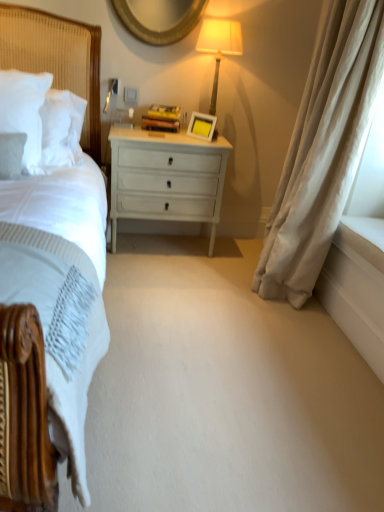
Question: From a real-world perspective, relative to matte cream lampshade at upper right, is white soft pillow at left vertically above or below?

Choices:
 (A) below
 (B) above

Answer: (A)

Question: From their relative heights in the image, would you say white soft pillow at left is taller or shorter than matte cream lampshade at upper right?

Choices:
 (A) short
 (B) tall

Answer: (A)

Question: Estimate the real-world distances between objects in this image. Which object is closer to the white soft pillow at left?

Choices:
 (A) gold textured mirror at upper center
 (B) beige velvet curtain at right
 (C) matte cream lampshade at upper right
 (D) yellow matte picture frame at center
 (E) white textured headboard at left

Answer: (E)

Question: Considering the real-world distances, which object is closest to the white textured headboard at left?

Choices:
 (A) matte cream lampshade at upper right
 (B) white soft pillow at left
 (C) yellow matte picture frame at center
 (D) gold textured mirror at upper center
 (E) white glossy drawer at center

Answer: (B)